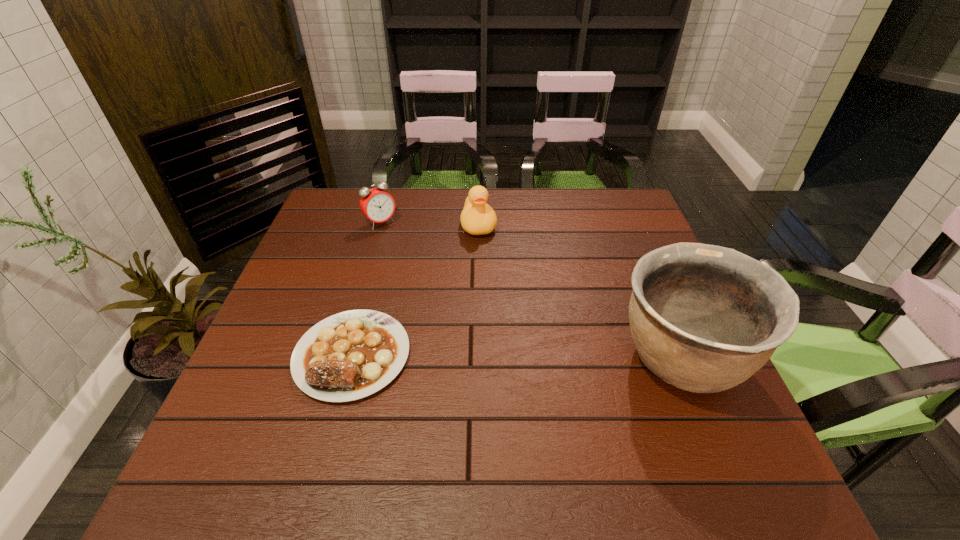
Find the location of a particular element. This screenshot has height=540, width=960. the shortest object is located at coordinates (350, 355).

This screenshot has width=960, height=540. I want to click on the tallest object, so click(x=704, y=318).

Where is `the rightmost object`? The height and width of the screenshot is (540, 960). the rightmost object is located at coordinates click(x=704, y=318).

Locate an element on the screen. This screenshot has height=540, width=960. duck is located at coordinates (477, 218).

Where is `alarm clock`? This screenshot has height=540, width=960. alarm clock is located at coordinates [376, 204].

This screenshot has height=540, width=960. What are the coordinates of `vacant space located 0.120m on the right of the steak` in the screenshot? It's located at (464, 355).

What are the coordinates of `vacant space located 0.100m on the left of the tallest object` in the screenshot? It's located at (567, 360).

Locate an element on the screen. This screenshot has height=540, width=960. free location located 0.360m on the face of the third object from left to right is located at coordinates (500, 333).

Where is `vacant area situated 0.100m on the face of the third object from left to right`? vacant area situated 0.100m on the face of the third object from left to right is located at coordinates (486, 262).

The width and height of the screenshot is (960, 540). In order to click on free space located 0.360m on the face of the third object from left to right in this screenshot , I will do `click(500, 333)`.